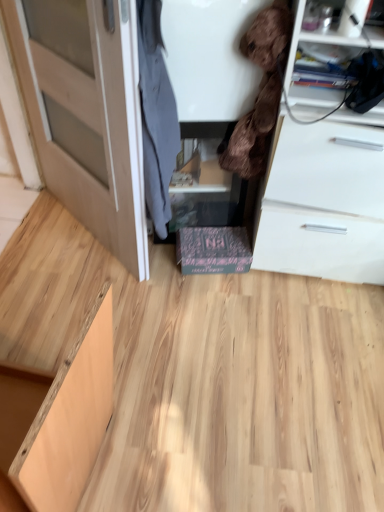
Question: Should I look upward or downward to see light wood cabinet at lower left, the 2th cabinetry in the back-to-front sequence?

Choices:
 (A) down
 (B) up

Answer: (A)

Question: Is light wood cabinet at lower left, which ranks as the first cabinetry in left-to-right order, surrounded by black cardboard box at center, marked as the 1th cabinetry in a right-to-left arrangement?

Choices:
 (A) yes
 (B) no

Answer: (B)

Question: Would you say black cardboard box at center, which is counted as the 2th cabinetry, starting from the front, is outside light wood cabinet at lower left, acting as the first cabinetry starting from the front?

Choices:
 (A) yes
 (B) no

Answer: (A)

Question: Considering the relative sizes of black cardboard box at center, marked as the 1th cabinetry in a right-to-left arrangement, and light wood cabinet at lower left, acting as the first cabinetry starting from the front, in the image provided, is black cardboard box at center, marked as the 1th cabinetry in a right-to-left arrangement, thinner than light wood cabinet at lower left, acting as the first cabinetry starting from the front,?

Choices:
 (A) yes
 (B) no

Answer: (A)

Question: Is black cardboard box at center, marked as the 1th cabinetry in a right-to-left arrangement, closer to camera compared to light wood cabinet at lower left, which is the second cabinetry from right to left?

Choices:
 (A) yes
 (B) no

Answer: (B)

Question: Is the position of black cardboard box at center, marked as the 1th cabinetry in a right-to-left arrangement, more distant than that of light wood cabinet at lower left, which is the second cabinetry from right to left?

Choices:
 (A) yes
 (B) no

Answer: (A)

Question: Is black cardboard box at center, the first cabinetry from the back, placed right next to light wood cabinet at lower left, which ranks as the first cabinetry in left-to-right order?

Choices:
 (A) no
 (B) yes

Answer: (A)

Question: Is brown plush toy at upper right, acting as the first clothing starting from the right, at the right side of transparent glass door at left?

Choices:
 (A) no
 (B) yes

Answer: (B)

Question: From the image's perspective, is brown plush toy at upper right, acting as the first clothing starting from the right, on top of transparent glass door at left?

Choices:
 (A) no
 (B) yes

Answer: (A)

Question: From a real-world perspective, is brown plush toy at upper right, acting as the first clothing starting from the right, on top of transparent glass door at left?

Choices:
 (A) no
 (B) yes

Answer: (B)

Question: Could transparent glass door at left be considered to be inside brown plush toy at upper right, the second clothing positioned from the left?

Choices:
 (A) yes
 (B) no

Answer: (B)

Question: Is brown plush toy at upper right, acting as the first clothing starting from the right, further to the viewer compared to transparent glass door at left?

Choices:
 (A) yes
 (B) no

Answer: (B)

Question: Can you confirm if brown plush toy at upper right, acting as the first clothing starting from the right, is wider than transparent glass door at left?

Choices:
 (A) no
 (B) yes

Answer: (A)

Question: From a real-world perspective, is light wood cabinet at lower left, which is the second cabinetry from right to left, over light brown wood door at left?

Choices:
 (A) yes
 (B) no

Answer: (B)